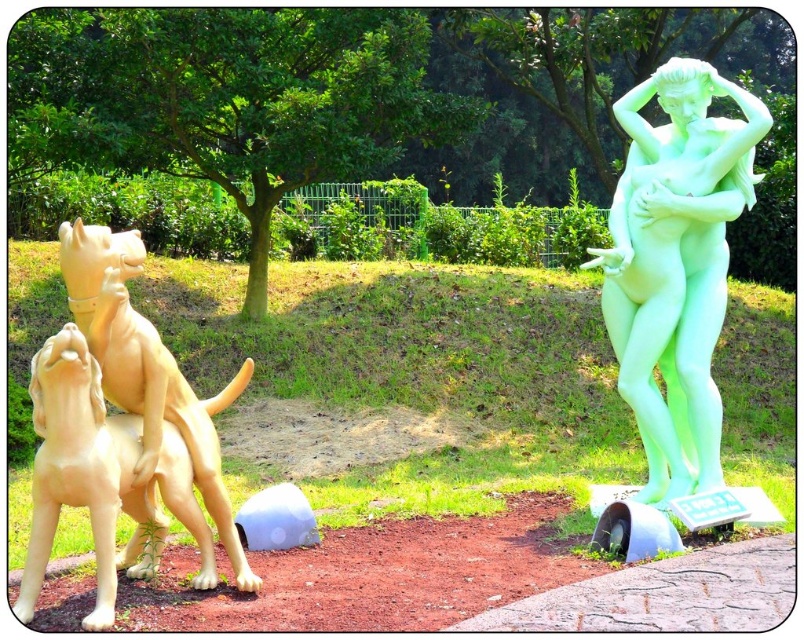
You are a visitor at an art exhibition and want to take a photo of both the green translucent statue at right and the matte yellow dog at left in the same frame. Based on their positions and sizes, do you think you can fit both into your camera viewfinder without moving your position?

The green translucent statue at right might be wider than matte yellow dog at left, so there is a possibility that the statue is wider and could block the view of the matte yellow dog at left if they are positioned far apart. However, without exact measurements, it is uncertain if both can fit in the frame.

You are an art curator planning to move the green translucent statue at right and the matte yellow dog at left to a new exhibition space. The entrance has a height restriction of 2 meters. Can both sculptures pass through without any adjustments?

The green translucent statue at right is taller than the matte yellow dog at left. Since the height restriction is 2 meters, we need to know the exact height of the taller sculpture. However, the description only states their relative heights. Without specific measurements, we cannot confirm if both can pass.

You are standing in the park and see the green translucent statue at right and the matte yellow dog at left. Which sculpture is higher up in the image?

The green translucent statue at right is located above the matte yellow dog at left, so it is higher up in the image.